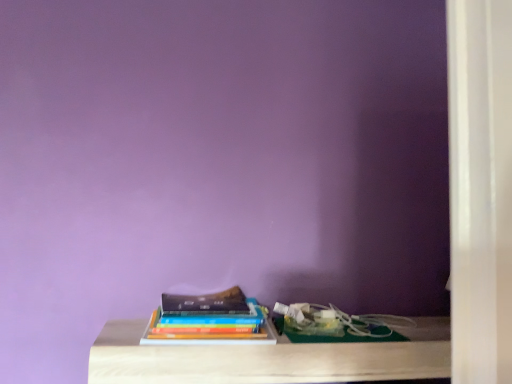
Question: Should I look upward or downward to see hardcover books at center?

Choices:
 (A) down
 (B) up

Answer: (A)

Question: Is light wood table at center far away from hardcover books at center?

Choices:
 (A) no
 (B) yes

Answer: (A)

Question: Could you tell me if light wood table at center is facing hardcover books at center?

Choices:
 (A) no
 (B) yes

Answer: (A)

Question: Does light wood table at center lie in front of hardcover books at center?

Choices:
 (A) yes
 (B) no

Answer: (A)

Question: Is light wood table at center facing away from hardcover books at center?

Choices:
 (A) no
 (B) yes

Answer: (A)

Question: Is light wood table at center to the right of hardcover books at center from the viewer's perspective?

Choices:
 (A) no
 (B) yes

Answer: (B)

Question: From a real-world perspective, is light wood table at center positioned over hardcover books at center based on gravity?

Choices:
 (A) no
 (B) yes

Answer: (A)

Question: Is hardcover books at center not close to light wood table at center?

Choices:
 (A) no
 (B) yes

Answer: (A)

Question: Does hardcover books at center have a lesser width compared to light wood table at center?

Choices:
 (A) yes
 (B) no

Answer: (A)

Question: Is hardcover books at center to the left of light wood table at center from the viewer's perspective?

Choices:
 (A) yes
 (B) no

Answer: (A)

Question: Is hardcover books at center outside of light wood table at center?

Choices:
 (A) yes
 (B) no

Answer: (A)

Question: From a real-world perspective, is hardcover books at center below light wood table at center?

Choices:
 (A) yes
 (B) no

Answer: (B)

Question: Is hardcover books at center oriented towards light wood table at center?

Choices:
 (A) no
 (B) yes

Answer: (A)

Question: From a real-world perspective, relative to light wood table at center, is hardcover books at center vertically above or below?

Choices:
 (A) above
 (B) below

Answer: (A)